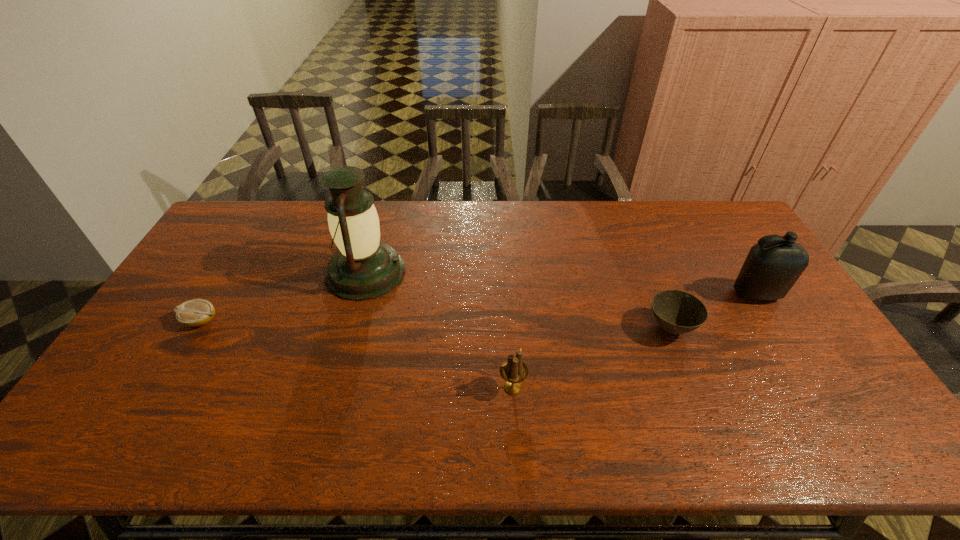
At what (x,y) coordinates should I click in order to perform the action: click on vacant area that lies between the fourth object from right to left and the fourth shortest object. Please return your answer as a coordinate pair (x, y). The image size is (960, 540). Looking at the image, I should click on (561, 283).

I want to click on object that is the fourth closest to the leftmost object, so click(x=771, y=268).

In order to click on the fourth closest object to the fourth object from left to right in this screenshot , I will do `click(196, 312)`.

At what (x,y) coordinates should I click in order to perform the action: click on free location that satisfies the following two spatial constraints: 1. with the light compartment facing forward on the lantern; 2. on the back side of the bottle. Please return your answer as a coordinate pair (x, y). The width and height of the screenshot is (960, 540). Looking at the image, I should click on (360, 294).

Where is `blank space that satisfies the following two spatial constraints: 1. on the back side of the nearest object; 2. on the right side of the second tallest object`? The width and height of the screenshot is (960, 540). blank space that satisfies the following two spatial constraints: 1. on the back side of the nearest object; 2. on the right side of the second tallest object is located at coordinates (507, 294).

Locate an element on the screen. Image resolution: width=960 pixels, height=540 pixels. vacant position in the image that satisfies the following two spatial constraints: 1. with the light compartment facing forward on the lantern; 2. on the front side of the shortest object is located at coordinates (352, 321).

Image resolution: width=960 pixels, height=540 pixels. What are the coordinates of `vacant area in the image that satisfies the following two spatial constraints: 1. on the back side of the rightmost object; 2. on the left side of the leftmost object` in the screenshot? It's located at (217, 294).

This screenshot has height=540, width=960. What are the coordinates of `blank area in the image that satisfies the following two spatial constraints: 1. on the back side of the bottle; 2. on the right side of the leftmost object` in the screenshot? It's located at (217, 294).

I want to click on vacant space that satisfies the following two spatial constraints: 1. with the light compartment facing forward on the second shortest object; 2. on the right side of the lantern, so click(x=350, y=328).